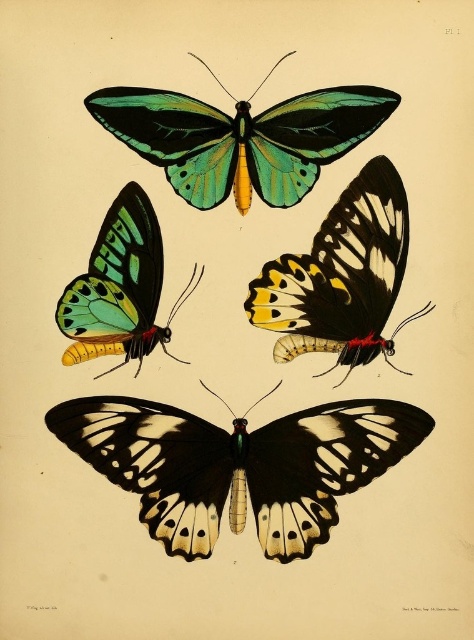
You are an entomologist examining the vintage illustration. You notice two butterflies in the upper section of the image. The green glossy butterfly at upper center and the shiny green and yellow butterfly at upper left. Which butterfly appears to be in front of the other?

The green glossy butterfly at upper center is positioned over the shiny green and yellow butterfly at upper left, so it appears to be in front.

Based on the photo, you are holding a magnifying glass 4 feet away from the shiny green and black butterfly at upper center. Can you see the butterfly clearly through the magnifying glass?

The shiny green and black butterfly at upper center is 3.97 feet away from the camera, which is less than the 4 feet distance you are holding the magnifying glass. Since the magnifying glass is designed to be used at a closer distance, this might make it harder to focus. Therefore, you might not see the butterfly clearly through the magnifying glass.

You are an entomologist examining the butterflies in the image. You need to identify the relative positions of the green glossy butterfly at upper center and the shiny green and yellow butterfly at upper left. Which butterfly is positioned to the right of the other?

The green glossy butterfly at upper center is positioned to the right of the shiny green and yellow butterfly at upper left.